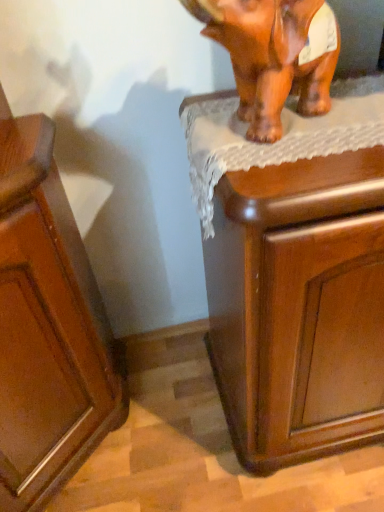
This screenshot has height=512, width=384. I want to click on free location in front of brown glossy elephant at upper right, so click(x=304, y=162).